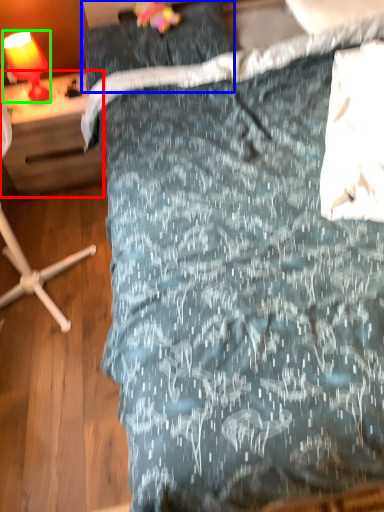
Question: Which object is the closest to the desk (highlighted by a red box)? Choose among these: pillow (highlighted by a blue box) or lamp (highlighted by a green box).

Choices:
 (A) pillow
 (B) lamp

Answer: (B)